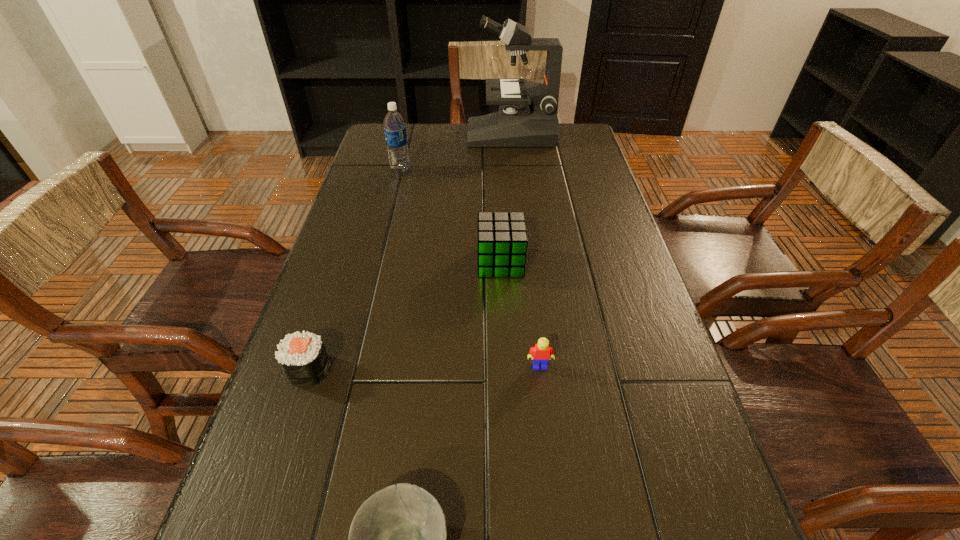
Locate an element on the screen. the farthest object is located at coordinates (527, 116).

Where is `microscope`? The height and width of the screenshot is (540, 960). microscope is located at coordinates (527, 116).

At what (x,y) coordinates should I click in order to perform the action: click on the fifth nearest object. Please return your answer as a coordinate pair (x, y). The height and width of the screenshot is (540, 960). Looking at the image, I should click on (394, 124).

What are the coordinates of `the fifth object from right to left` in the screenshot? It's located at point(394,124).

I want to click on the third tallest object, so click(x=502, y=242).

Locate an element on the screen. cube is located at coordinates (502, 242).

Image resolution: width=960 pixels, height=540 pixels. What are the coordinates of `Lego` in the screenshot? It's located at (541, 353).

Where is `sushi`? Image resolution: width=960 pixels, height=540 pixels. sushi is located at coordinates (302, 356).

I want to click on free space located through the eyepieces of the microscope, so click(x=385, y=134).

The image size is (960, 540). I want to click on vacant space located 0.250m through the eyepieces of the microscope, so click(396, 134).